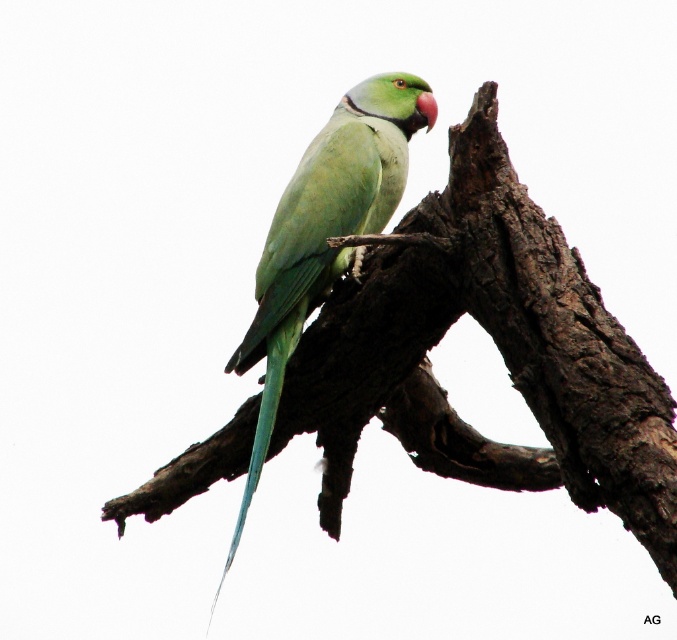
Question: Which point appears farthest from the camera in this image?

Choices:
 (A) (466, 310)
 (B) (318, 186)

Answer: (B)

Question: Is green matte tree branch at center to the left of green matte parrot at center from the viewer's perspective?

Choices:
 (A) yes
 (B) no

Answer: (B)

Question: From the image, what is the correct spatial relationship of green matte tree branch at center in relation to green matte parrot at center?

Choices:
 (A) below
 (B) above

Answer: (A)

Question: Which point is farther to the camera?

Choices:
 (A) (429, 84)
 (B) (202, 458)

Answer: (B)

Question: Is the position of green matte tree branch at center more distant than that of green matte parrot at center?

Choices:
 (A) no
 (B) yes

Answer: (A)